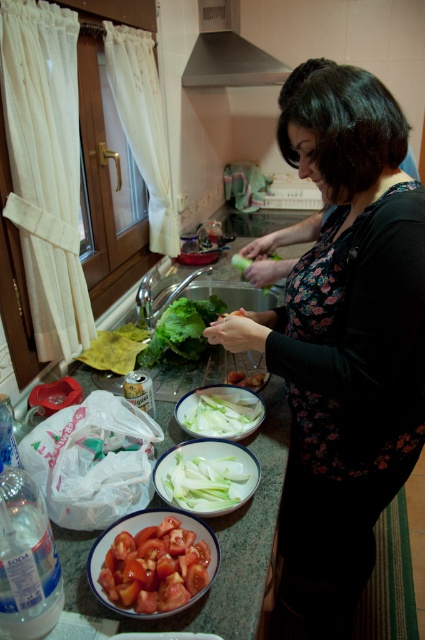
Looking at this image, you have a white glossy platter at center and a white smooth onion at center. Which one has a larger width?

The white glossy platter at center is wider than the white smooth onion at center according to the description.

In the kitchen scene, you need to choose between the sliced matte tomato at lower left and the green leafy lettuce at center for a recipe that requires larger ingredients. Which one should you pick?

The green leafy lettuce at center is larger than the sliced matte tomato at lower left, so you should pick the green leafy lettuce at center for the recipe.